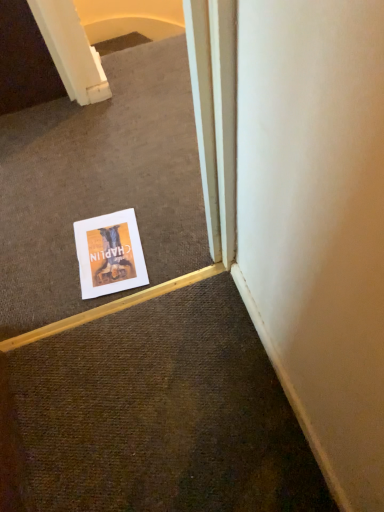
In order to click on vacant point above white paper at center (from a real-world perspective) in this screenshot , I will do `click(95, 174)`.